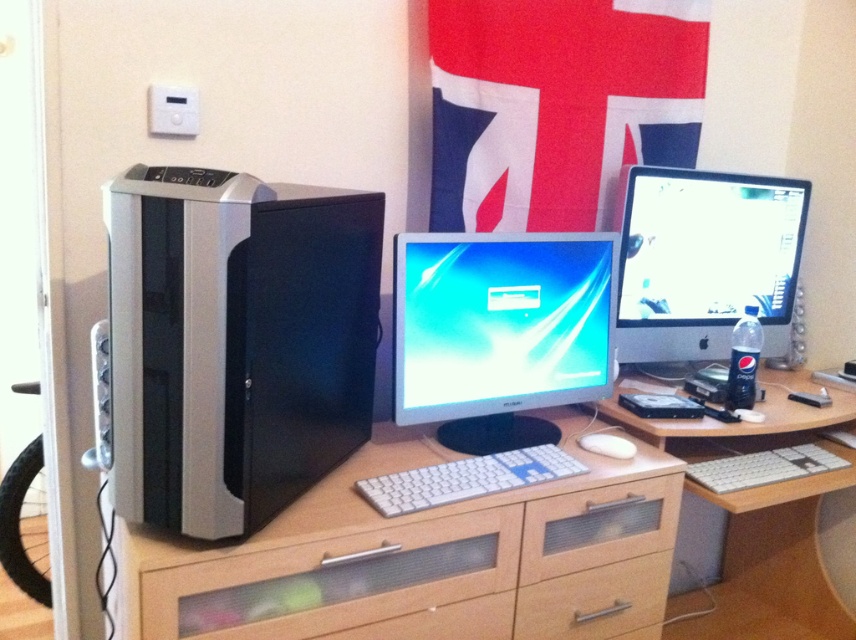
Can you confirm if satin silver monitor at center right is thinner than wooden drawer at center?

No.

Between satin silver monitor at center right and wooden drawer at center, which one is positioned lower?

wooden drawer at center is below.

Between point (715, 358) and point (542, 634), which one is positioned behind?

Point (715, 358)

At what (x,y) coordinates should I click in order to perform the action: click on satin silver monitor at center right. Please return your answer as a coordinate pair (x, y). Looking at the image, I should click on (705, 260).

Does silver/black plastic computer tower at left have a lesser height compared to black plastic speaker at right?

Incorrect, silver/black plastic computer tower at left's height does not fall short of black plastic speaker at right's.

Who is shorter, silver/black plastic computer tower at left or black plastic speaker at right?

black plastic speaker at right is shorter.

Is point (186, 234) positioned in front of point (795, 304)?

Yes, point (186, 234) is closer to viewer.

Where is `silver/black plastic computer tower at left`? Image resolution: width=856 pixels, height=640 pixels. silver/black plastic computer tower at left is located at coordinates (235, 342).

Between light brown wood desk at center and white plastic keyboard at center, which one has more height?

light brown wood desk at center

Between point (770, 493) and point (399, 506), which one is positioned in front?

Positioned in front is point (399, 506).

Find the location of a particular element. light brown wood desk at center is located at coordinates (759, 518).

Where is `light brown wood desk at center`? light brown wood desk at center is located at coordinates (759, 518).